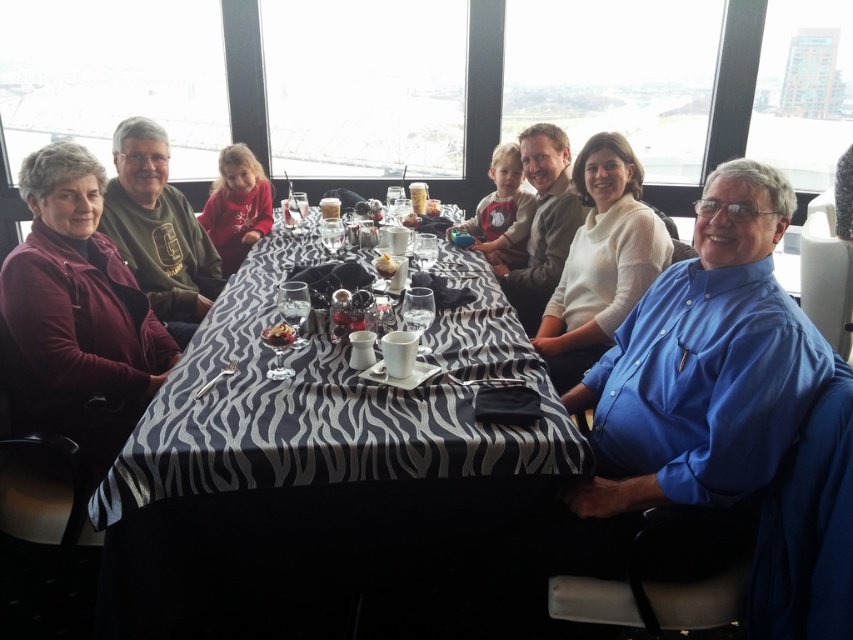
You are part of a group seated around the table and want to reach for the white crumbly cake at center without disturbing the smooth chocolate cake at center. Which direction should you move your hand to grab it?

The white crumbly cake at center is to the left of the smooth chocolate cake at center, so you should move your hand to the left to grab it without disturbing the other cake.